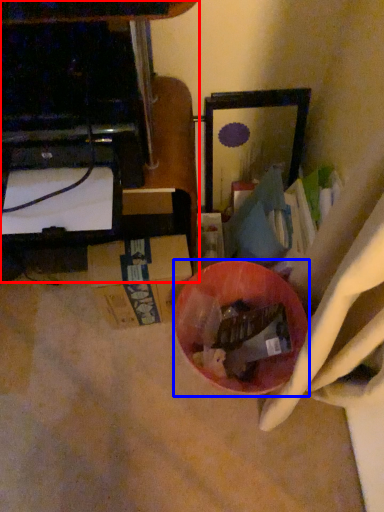
Question: Among these objects, which one is farthest to the camera, furniture (highlighted by a red box) or bowl (highlighted by a blue box)?

Choices:
 (A) furniture
 (B) bowl

Answer: (B)